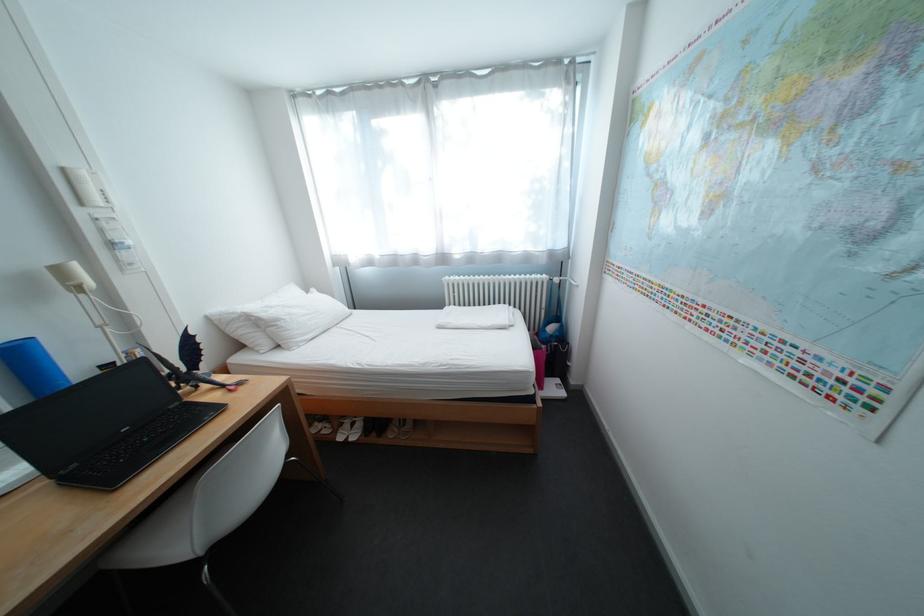
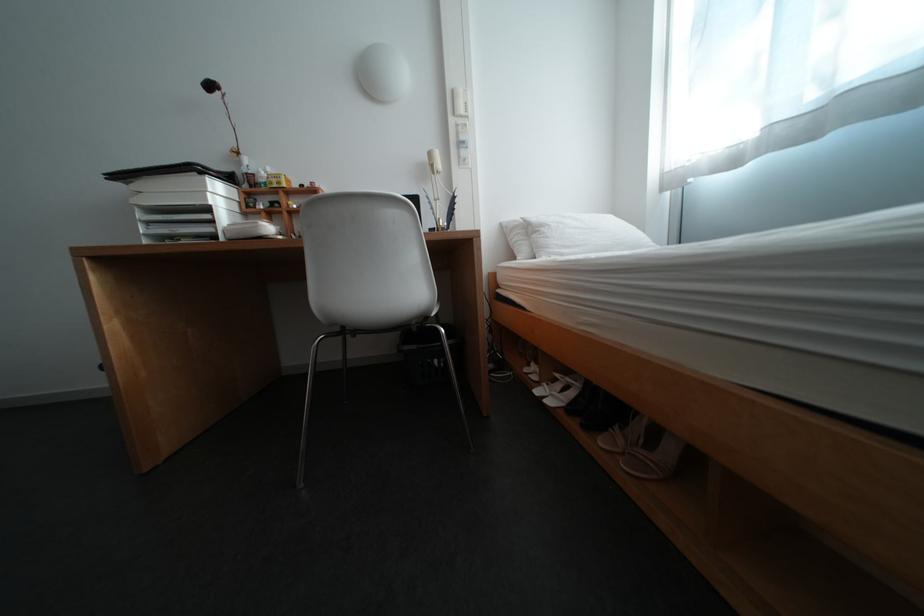
Find the pixel in the second image that matches [76,171] in the first image.

(466, 92)